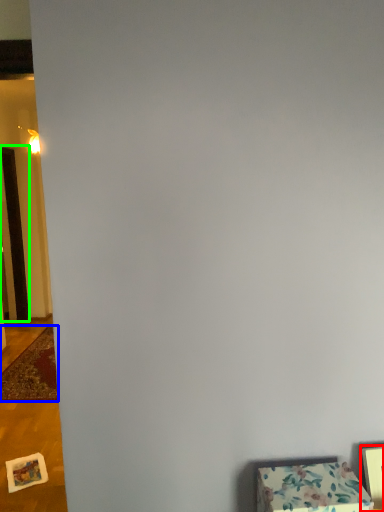
Question: Which is farther away from picture frame (highlighted by a red box)? mat (highlighted by a blue box) or door (highlighted by a green box)?

Choices:
 (A) mat
 (B) door

Answer: (B)